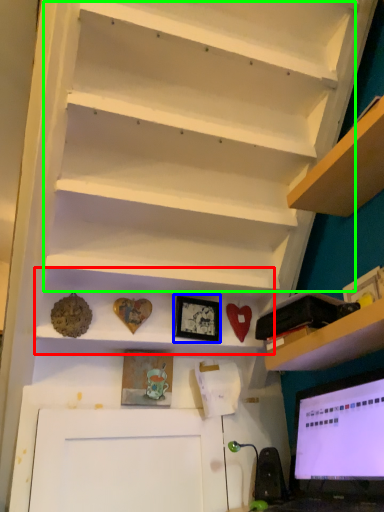
Question: Based on their relative distances, which object is farther from cabinet (highlighted by a red box)? Choose from picture frame (highlighted by a blue box) and stair (highlighted by a green box).

Choices:
 (A) picture frame
 (B) stair

Answer: (B)